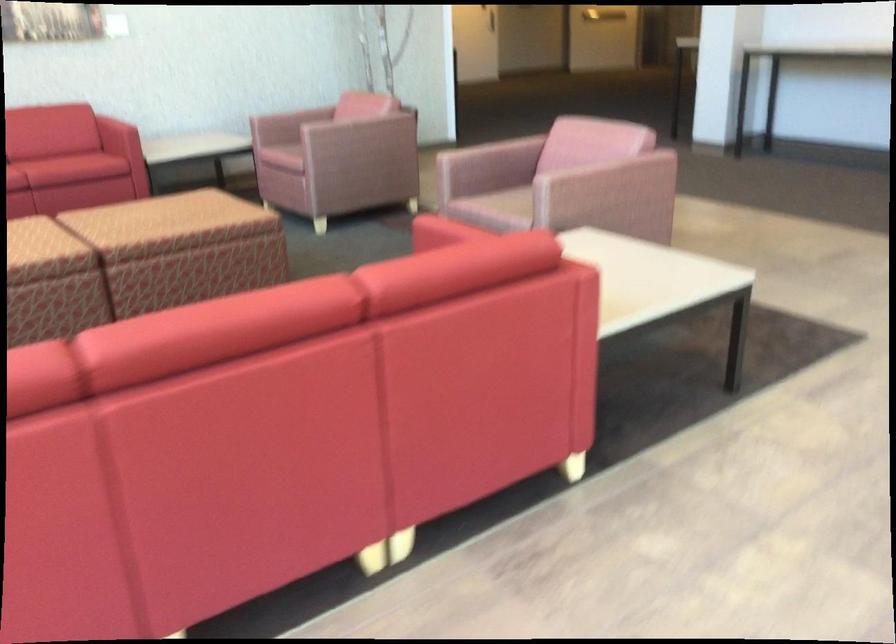
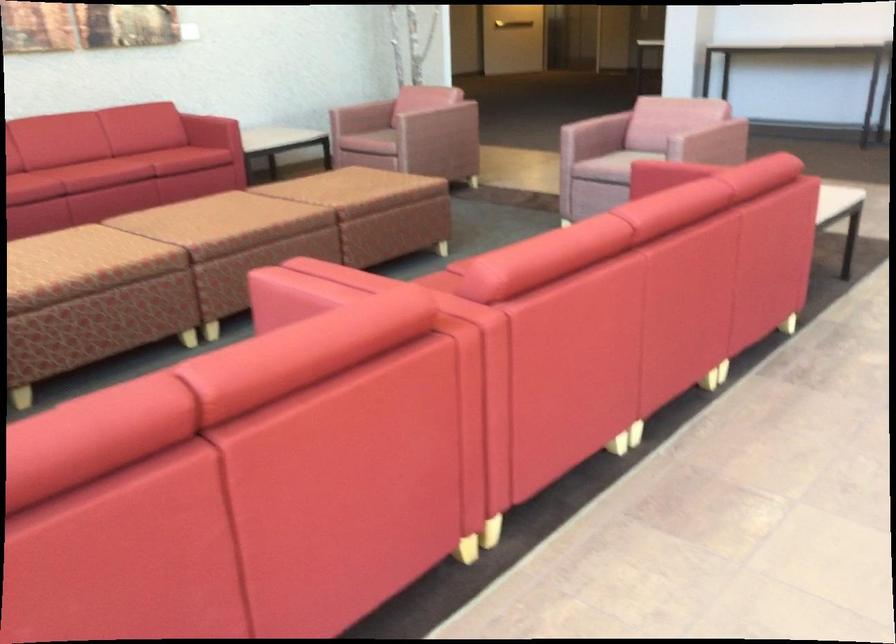
Locate, in the second image, the point that corresponds to the point at 478,202 in the first image.

(615, 166)